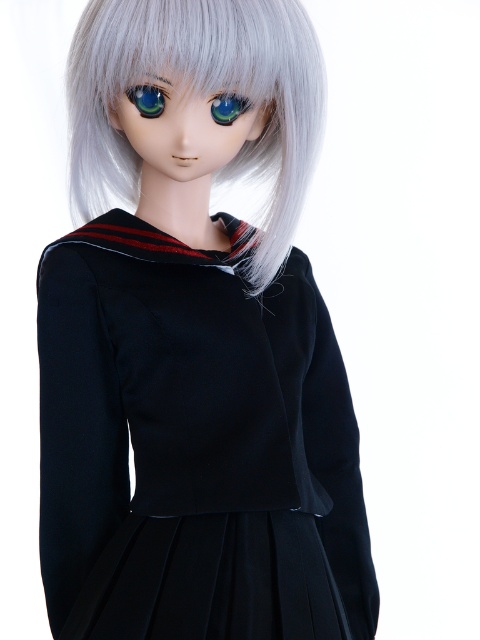
Looking at this image, which is above, matte black dress at center or green glossy eye at center?

green glossy eye at center is higher up.

Which is in front, point (170, 145) or point (162, 92)?

Point (162, 92) is in front.

Image resolution: width=480 pixels, height=640 pixels. What do you see at coordinates (194, 346) in the screenshot?
I see `matte black dress at center` at bounding box center [194, 346].

This screenshot has width=480, height=640. I want to click on matte black dress at center, so click(194, 346).

The width and height of the screenshot is (480, 640). What are the coordinates of `matte black dress at center` in the screenshot? It's located at (194, 346).

Looking at this image, between matte black dress at center and sleek silver hair at center, which one is positioned lower?

matte black dress at center is lower down.

This screenshot has width=480, height=640. Identify the location of matte black dress at center. (194, 346).

Image resolution: width=480 pixels, height=640 pixels. What do you see at coordinates (201, 90) in the screenshot? I see `sleek silver hair at center` at bounding box center [201, 90].

The image size is (480, 640). Find the location of `sleek silver hair at center`. sleek silver hair at center is located at coordinates 201,90.

You are a GUI agent. You are given a task and a screenshot of the screen. Output one action in this format:
    pyautogui.click(x=<x>, y=<y>)
    Task: Click on the sleek silver hair at center
    This screenshot has width=480, height=640.
    Given the screenshot: What is the action you would take?
    pyautogui.click(x=201, y=90)